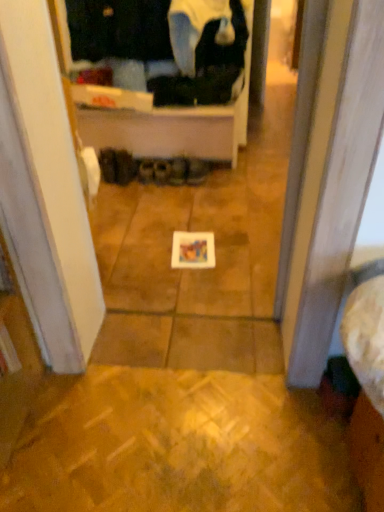
This screenshot has height=512, width=384. I want to click on free spot in front of brown suede shoes at center, which ranks as the third footwear in right-to-left order, so click(x=164, y=191).